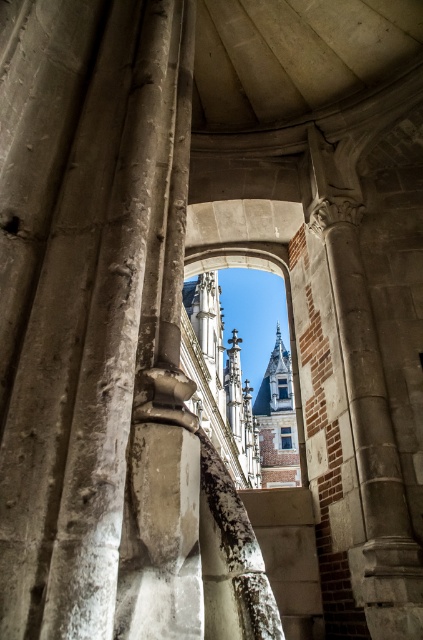
You are standing inside a historic building and notice two windows at the center of the structure. The blue glass window at center and the clear glass window at center. Which window would appear larger to someone looking at them from your position?

The blue glass window at center appears larger because it is closer to the viewer than the clear glass window at center.